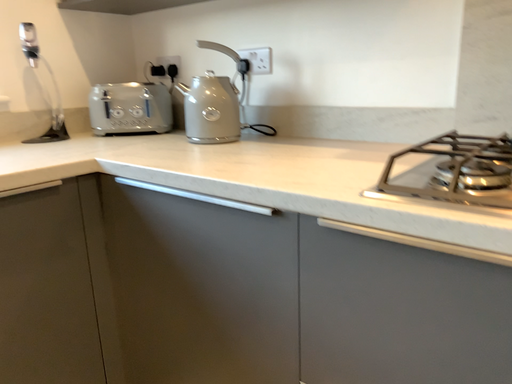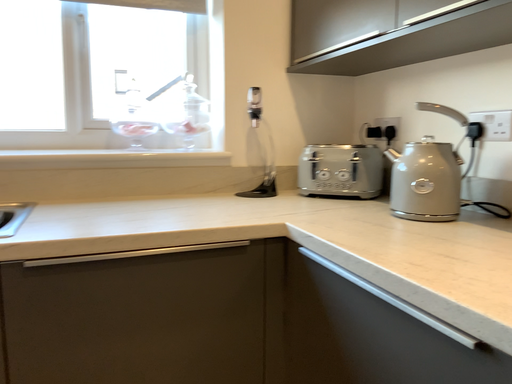
Question: How did the camera likely rotate when shooting the video?

Choices:
 (A) rotated left
 (B) rotated right

Answer: (A)